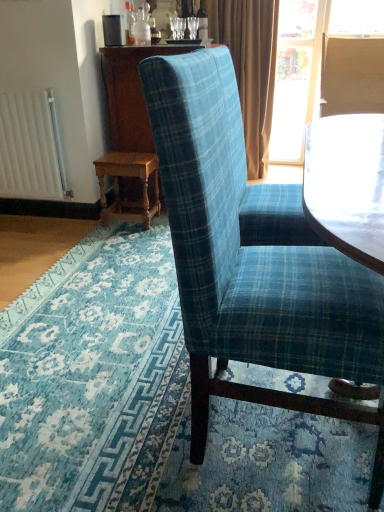
Question: Can wooden chair back at upper right be found inside white matte radiator at left?

Choices:
 (A) no
 (B) yes

Answer: (A)

Question: Considering the relative sizes of white matte radiator at left and wooden chair back at upper right in the image provided, is white matte radiator at left wider than wooden chair back at upper right?

Choices:
 (A) yes
 (B) no

Answer: (B)

Question: Considering the relative positions of white matte radiator at left and wooden chair back at upper right in the image provided, is white matte radiator at left to the left of wooden chair back at upper right from the viewer's perspective?

Choices:
 (A) yes
 (B) no

Answer: (A)

Question: Is white matte radiator at left far away from wooden chair back at upper right?

Choices:
 (A) yes
 (B) no

Answer: (A)

Question: Is the depth of white matte radiator at left greater than that of wooden chair back at upper right?

Choices:
 (A) yes
 (B) no

Answer: (B)

Question: Is white matte radiator at left smaller than wooden chair back at upper right?

Choices:
 (A) yes
 (B) no

Answer: (A)

Question: Can you confirm if wooden dresser at center is bigger than wooden chair back at upper right?

Choices:
 (A) yes
 (B) no

Answer: (A)

Question: Is wooden chair back at upper right at the back of wooden dresser at center?

Choices:
 (A) no
 (B) yes

Answer: (A)

Question: Would you consider wooden dresser at center to be distant from wooden chair back at upper right?

Choices:
 (A) no
 (B) yes

Answer: (B)

Question: Would you say wooden chair back at upper right is part of wooden dresser at center's contents?

Choices:
 (A) no
 (B) yes

Answer: (A)

Question: From the image's perspective, would you say wooden dresser at center is positioned over wooden chair back at upper right?

Choices:
 (A) yes
 (B) no

Answer: (B)

Question: Can you confirm if wooden dresser at center is smaller than wooden chair back at upper right?

Choices:
 (A) no
 (B) yes

Answer: (A)

Question: Are matte brown curtain at upper right and blue plaid fabric at center making contact?

Choices:
 (A) yes
 (B) no

Answer: (B)